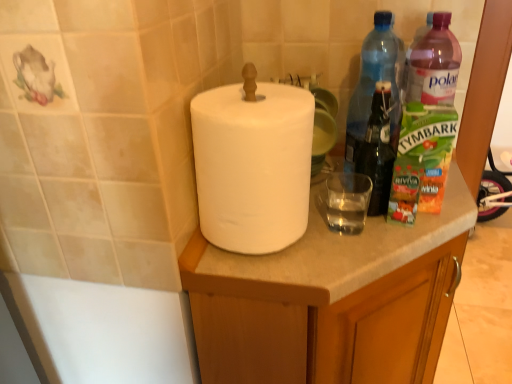
Find the location of a particular element. The width and height of the screenshot is (512, 384). free space in front of transparent plastic bottle at upper right, the second bottle in the right-to-left sequence is located at coordinates (378, 227).